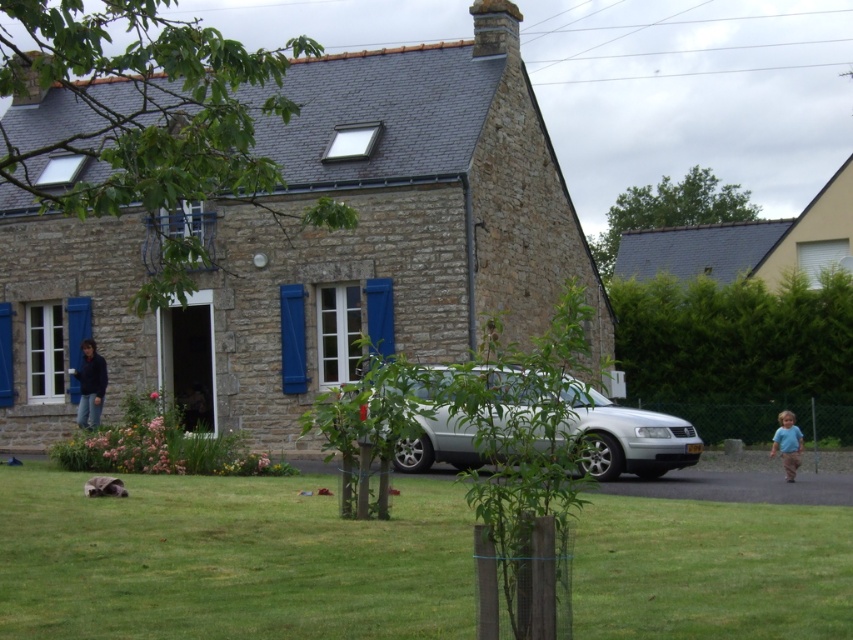
You are a drone operator who needs to fly a drone from the green grass at lower center to the gray slate roof at upper right. Given that the drone has a maximum flight distance of 100 feet, will it be able to reach the roof without recharging?

The distance between the green grass at lower center and the gray slate roof at upper right is 102.57 feet, which exceeds the drone operator stated maximum flight distance of 100 feet. Therefore, the drone will not be able to reach the roof without recharging.